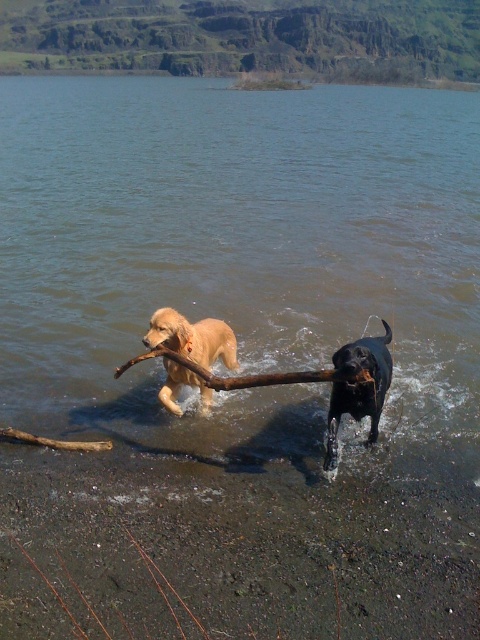
Is brown matte water at center bigger than shiny black dog at center?

Yes, brown matte water at center is bigger than shiny black dog at center.

Does brown matte water at center appear on the right side of shiny black dog at center?

Yes, brown matte water at center is to the right of shiny black dog at center.

Find the location of a particular element. brown matte water at center is located at coordinates (241, 259).

Can you confirm if shiny black dog at center is taller than brown wood branch at center?

Yes, shiny black dog at center is taller than brown wood branch at center.

Which is in front, point (330, 451) or point (245, 376)?

Point (330, 451) is in front.

Where is `shiny black dog at center`? This screenshot has height=640, width=480. shiny black dog at center is located at coordinates (359, 387).

Does brown matte water at center have a lesser width compared to golden fur dog at center?

No.

Is brown matte water at center to the right of golden fur dog at center from the viewer's perspective?

Yes, brown matte water at center is to the right of golden fur dog at center.

Describe the element at coordinates (241, 259) in the screenshot. Image resolution: width=480 pixels, height=640 pixels. I see `brown matte water at center` at that location.

Find the location of a particular element. The image size is (480, 640). brown matte water at center is located at coordinates (241, 259).